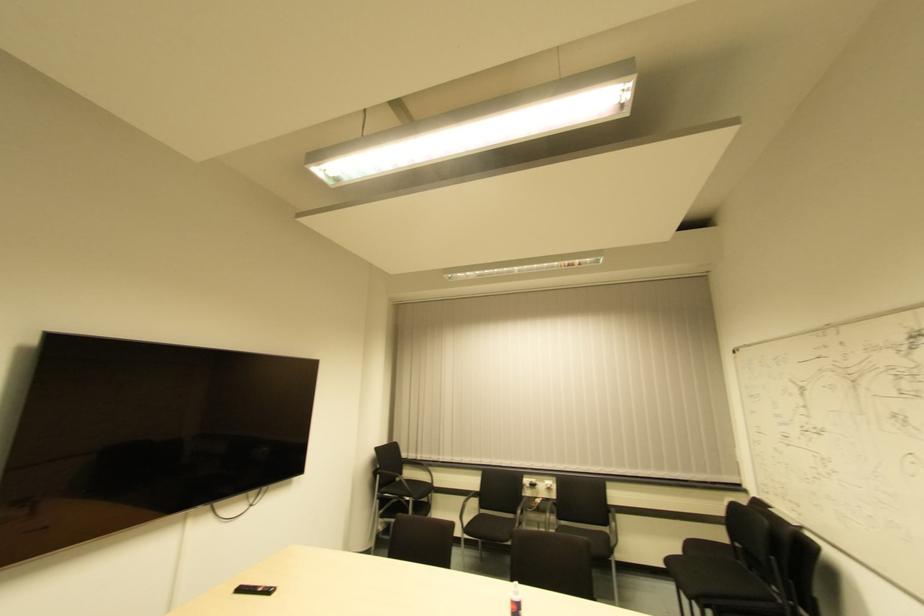
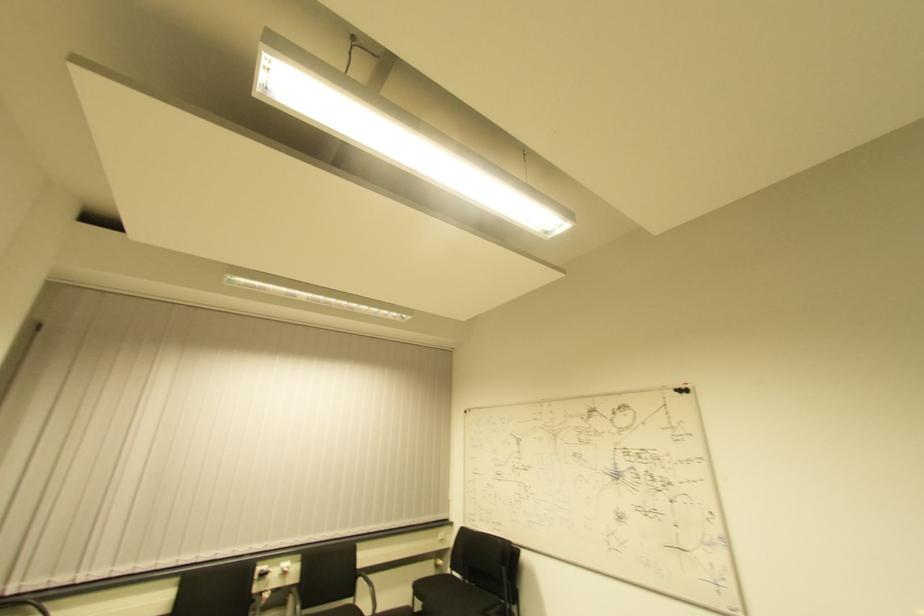
Locate, in the second image, the point that corresponds to (745,495) in the first image.

(450, 527)